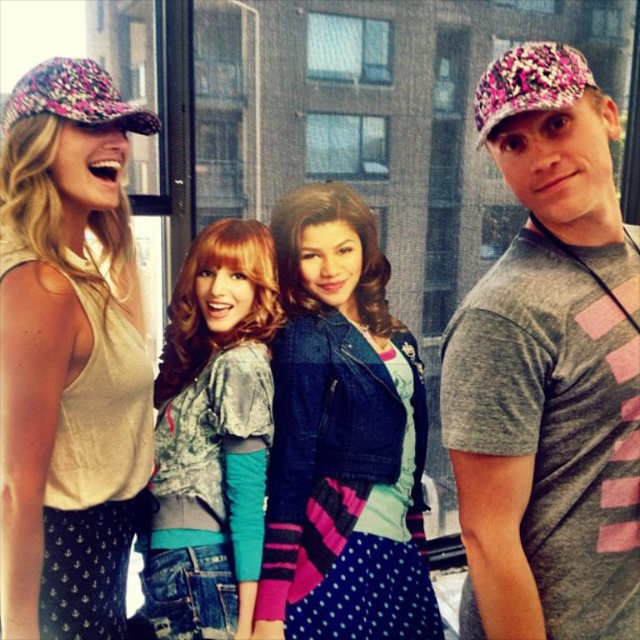
Which individual is wearing the matte floral cap at upper left?

The matte floral cap at upper left is worn by the person on the far left.

Looking at this image, you are a photographer trying to capture a candid shot of the matte floral cap at upper left and the distressed denim jacket at center. The camera you are using has a minimum focus distance of 10 inches. Can you focus on both objects simultaneously without moving the camera?

The matte floral cap at upper left and the distressed denim jacket at center are 10.73 inches apart. Since the distance between them is greater than the camera minimum focus distance of 10 inches, you can focus on both objects simultaneously without moving the camera.